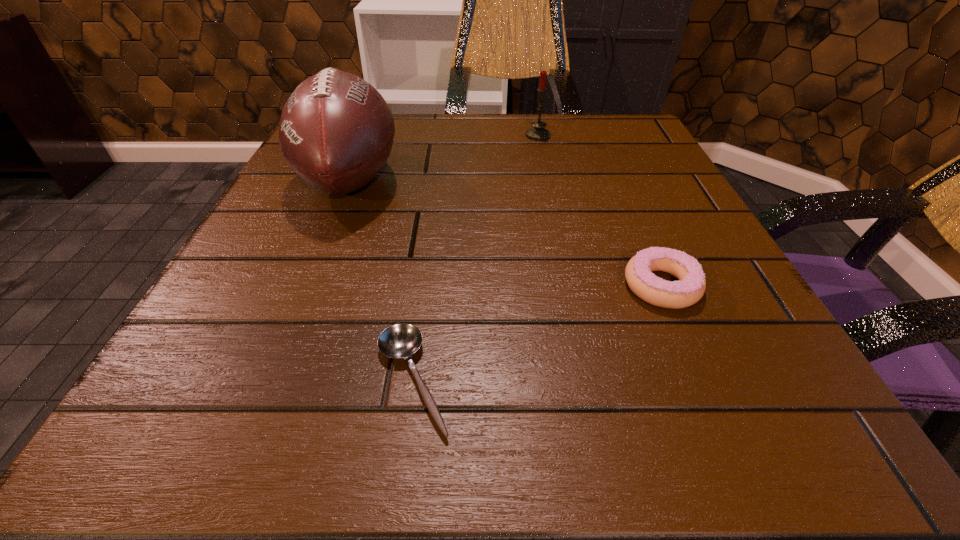
Locate an element on the screen. Image resolution: width=960 pixels, height=540 pixels. free region at the left edge of the desktop is located at coordinates (246, 254).

The height and width of the screenshot is (540, 960). Find the location of `free location at the right edge`. free location at the right edge is located at coordinates (641, 327).

In the image, there is a desktop. Identify the location of blank space at the far right corner. (586, 138).

Find the location of a particular element. Image resolution: width=960 pixels, height=540 pixels. free space at the near right corner of the desktop is located at coordinates (833, 446).

Image resolution: width=960 pixels, height=540 pixels. I want to click on vacant space that is in between the shortest object and the second tallest object, so click(x=475, y=258).

Identify the location of free space between the doughnut and the second farthest object. This screenshot has height=540, width=960. (506, 233).

You are a GUI agent. You are given a task and a screenshot of the screen. Output one action in this format:
    pyautogui.click(x=<x>, y=<y>)
    Task: Click on the vacant region between the third object from right to left and the candle
    The image size is (960, 540).
    Given the screenshot: What is the action you would take?
    pyautogui.click(x=475, y=258)

Locate an element on the screen. The image size is (960, 540). free space between the shortest object and the second tallest object is located at coordinates (475, 258).

Where is `free space between the rightmost object and the shortest object`? free space between the rightmost object and the shortest object is located at coordinates (537, 333).

You are a GUI agent. You are given a task and a screenshot of the screen. Output one action in this format:
    pyautogui.click(x=<x>, y=<y>)
    Task: Click on the vacant area that lies between the ladle and the farthest object
    This screenshot has width=960, height=540.
    Given the screenshot: What is the action you would take?
    pyautogui.click(x=475, y=258)